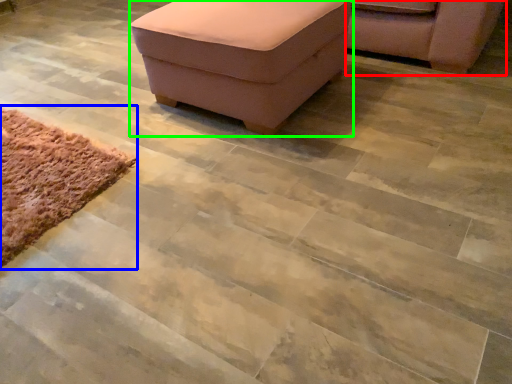
Question: Which object is the farthest from chair (highlighted by a red box)? Choose among these: mat (highlighted by a blue box) or furniture (highlighted by a green box).

Choices:
 (A) mat
 (B) furniture

Answer: (A)